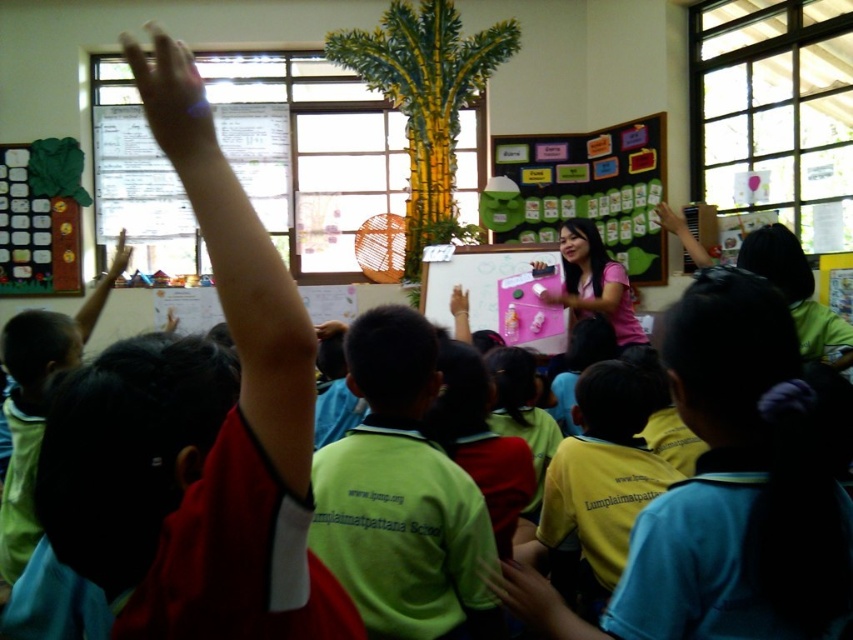
You are standing in the classroom and want to reach both the point at coordinates (239, 595) and the point at coordinates (576, 232). Which point should you approach first to reach the closer one first?

You should approach point (239, 595) first because it is closer to you than point (576, 232).